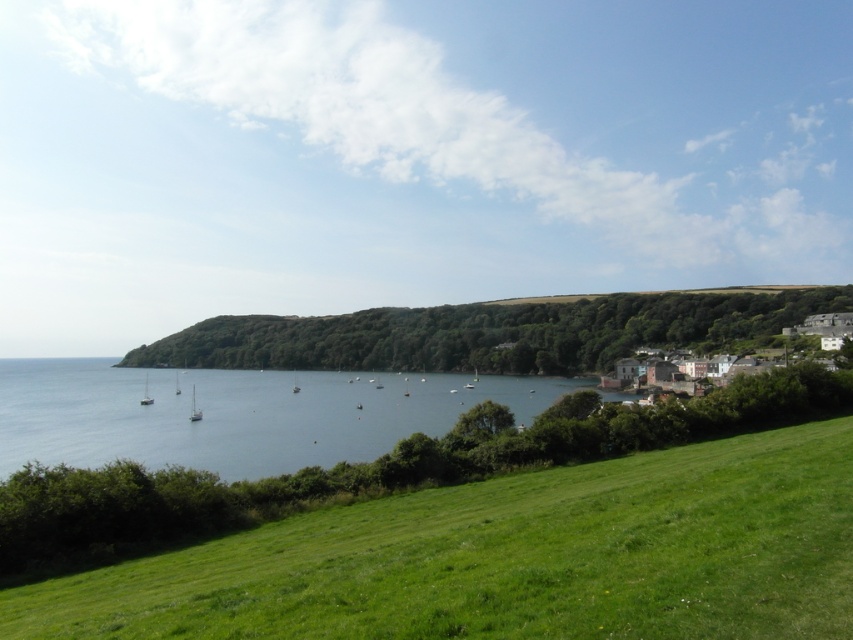
Does green grassy field at lower left lie behind green leafy hillside at center?

No.

Which is in front, point (358, 557) or point (601, 339)?

Point (358, 557)

At what (x,y) coordinates should I click in order to perform the action: click on green grassy field at lower left. Please return your answer as a coordinate pair (x, y). This screenshot has height=640, width=853. Looking at the image, I should click on (514, 557).

Does white glossy sailboat at center have a lesser width compared to white matte sailboat at left?

Indeed, white glossy sailboat at center has a lesser width compared to white matte sailboat at left.

Can you confirm if white glossy sailboat at center is positioned to the right of white matte sailboat at left?

Indeed, white glossy sailboat at center is positioned on the right side of white matte sailboat at left.

The height and width of the screenshot is (640, 853). I want to click on white glossy sailboat at center, so click(194, 408).

What do you see at coordinates (514, 557) in the screenshot? I see `green grassy field at lower left` at bounding box center [514, 557].

Where is `green grassy field at lower left`? Image resolution: width=853 pixels, height=640 pixels. green grassy field at lower left is located at coordinates (514, 557).

Identify the location of green grassy field at lower left. This screenshot has height=640, width=853. (514, 557).